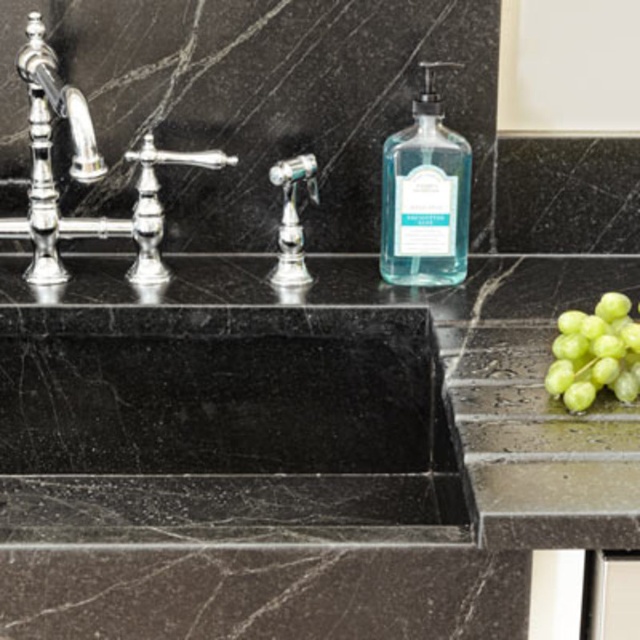
Does polished chrome faucet at left appear over polished chrome faucet at center?

Correct, polished chrome faucet at left is located above polished chrome faucet at center.

This screenshot has width=640, height=640. What do you see at coordinates (51, 157) in the screenshot? I see `polished chrome faucet at left` at bounding box center [51, 157].

Locate an element on the screen. polished chrome faucet at left is located at coordinates (51, 157).

Is black marble sink at center to the right of transparent glass soap dispenser at center from the viewer's perspective?

No, black marble sink at center is not to the right of transparent glass soap dispenser at center.

Is black marble sink at center taller than transparent glass soap dispenser at center?

Correct, black marble sink at center is much taller as transparent glass soap dispenser at center.

Does point (76, 584) come in front of point (385, 202)?

Yes, it is.

Find the location of `black marble sink at center`. black marble sink at center is located at coordinates (296, 451).

Between black marble sink at center and green matte grapes at right, which one has more height?

Standing taller between the two is black marble sink at center.

Can you confirm if black marble sink at center is smaller than green matte grapes at right?

Incorrect, black marble sink at center is not smaller in size than green matte grapes at right.

The width and height of the screenshot is (640, 640). Find the location of `black marble sink at center`. black marble sink at center is located at coordinates (296, 451).